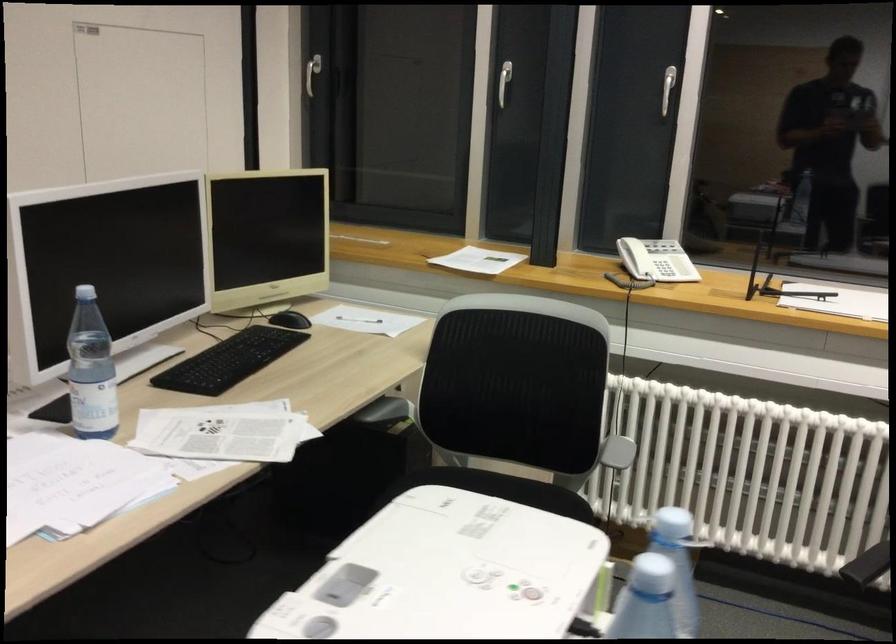
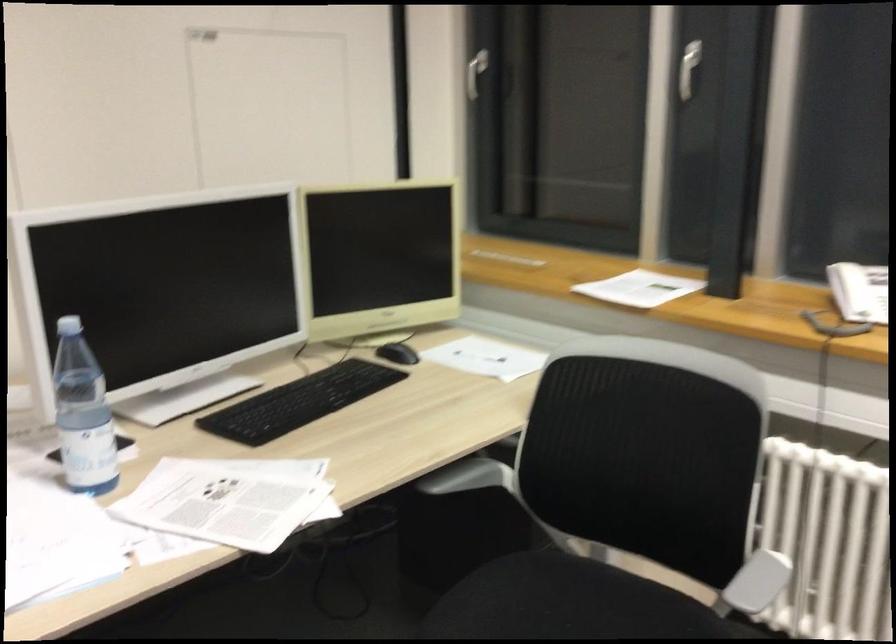
The point at [290,322] is marked in the first image. Where is the corresponding point in the second image?

(398, 353)